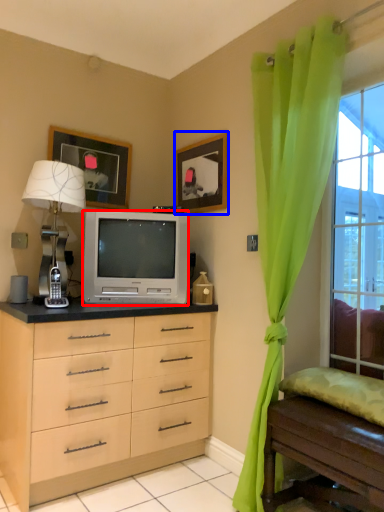
Question: Among these objects, which one is farthest to the camera, television (highlighted by a red box) or picture frame (highlighted by a blue box)?

Choices:
 (A) television
 (B) picture frame

Answer: (B)